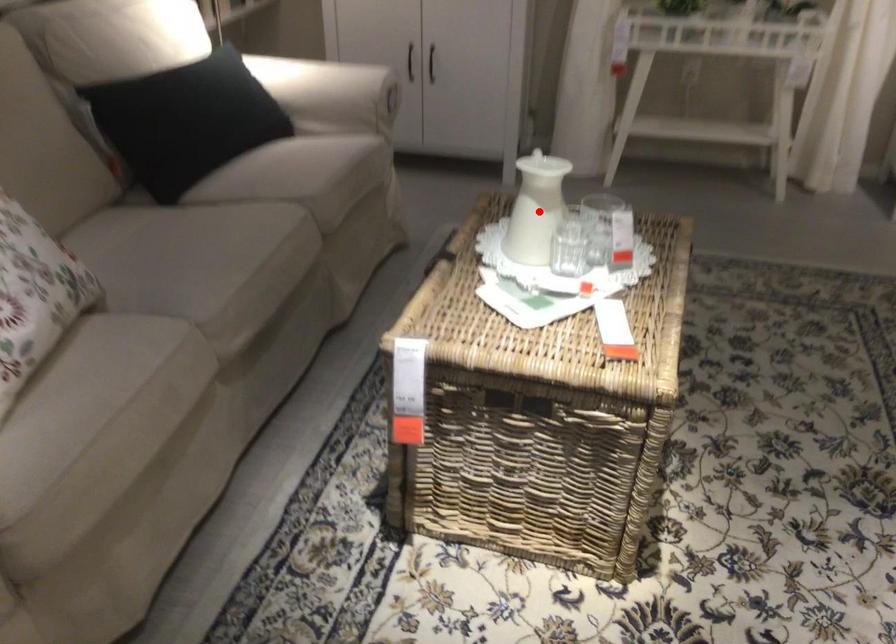
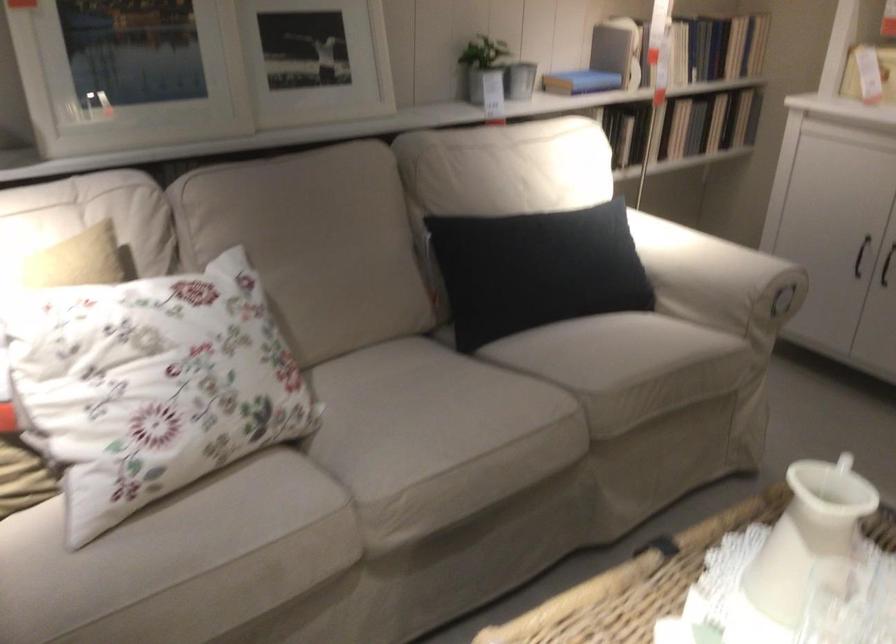
Locate, in the second image, the point that corresponds to the highlighted location in the first image.

(803, 552)